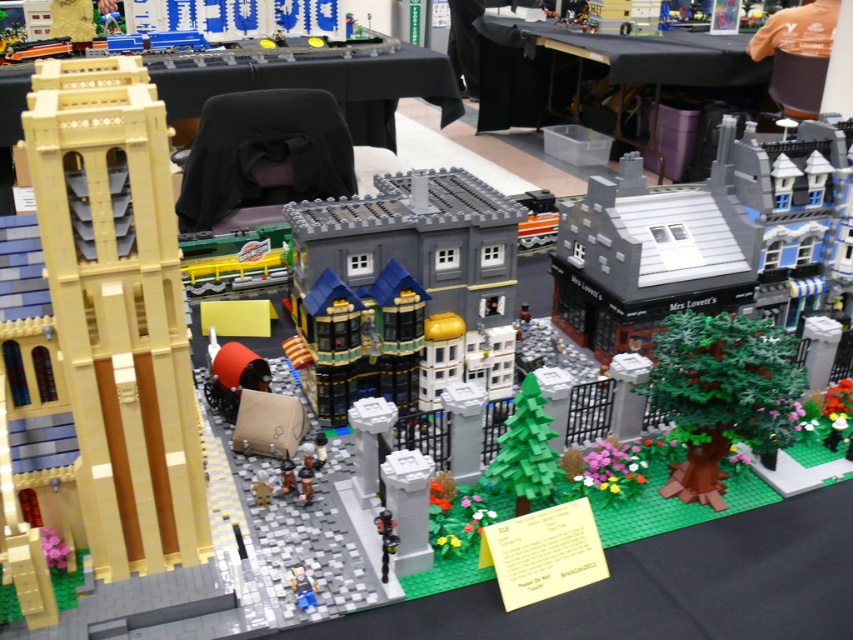
You are a visitor at the Lego exhibition and want to take a photo of both the green matte tree at center and the smooth plastic figure at center. Since you want them both in focus, you need to know their distance apart. Can you determine if they are close enough for a single photo?

The green matte tree at center has a larger size compared to smooth plastic figure at center, but this does not provide information about their distance apart. You will need to estimate their spatial arrangement or check the camera settings for depth of field.

You are a guest at the Lego exhibition and want to place a small souvenir on the table. The table is located at the coordinates provided. Is the table at point [316,81] large enough to accommodate the souvenir?

The point [316,81] indicates a black fabric table at upper center, so yes, the table is large enough to place the souvenir as it is a standard table size for such exhibitions.